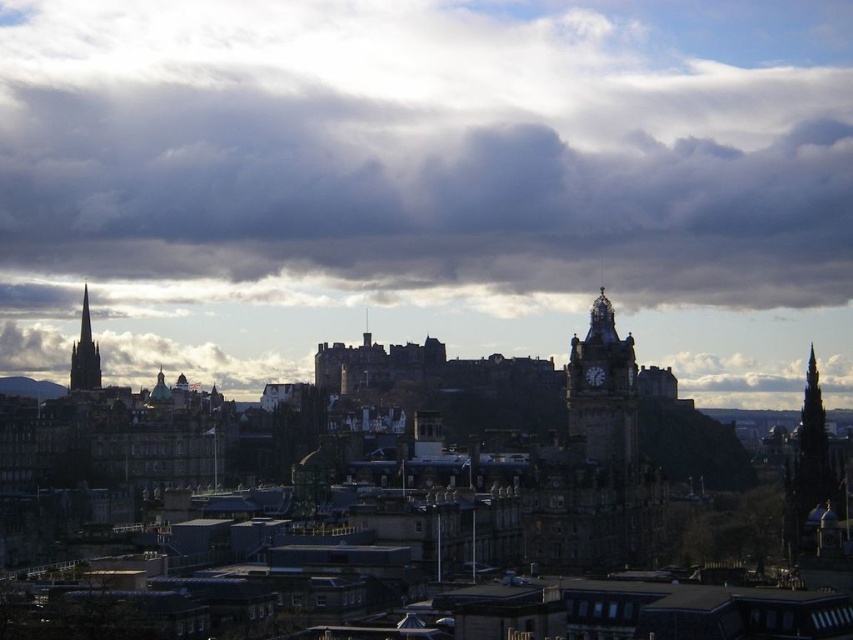
Question: Which point is farther to the camera?

Choices:
 (A) (619, 444)
 (B) (142, 22)
 (C) (86, 378)

Answer: (B)

Question: Which is nearer to the dark brown stone spire at left?

Choices:
 (A) stone clock tower at center
 (B) cloudy sky at upper center

Answer: (B)

Question: Observing the image, what is the correct spatial positioning of cloudy sky at upper center in reference to dark brown stone spire at left?

Choices:
 (A) above
 (B) below

Answer: (A)

Question: Is cloudy sky at upper center wider than dark brown stone spire at left?

Choices:
 (A) no
 (B) yes

Answer: (B)

Question: Does cloudy sky at upper center lie in front of stone clock tower at center?

Choices:
 (A) no
 (B) yes

Answer: (A)

Question: Which of these objects is positioned closest to the stone clock tower at center?

Choices:
 (A) cloudy sky at upper center
 (B) dark brown stone spire at left

Answer: (A)